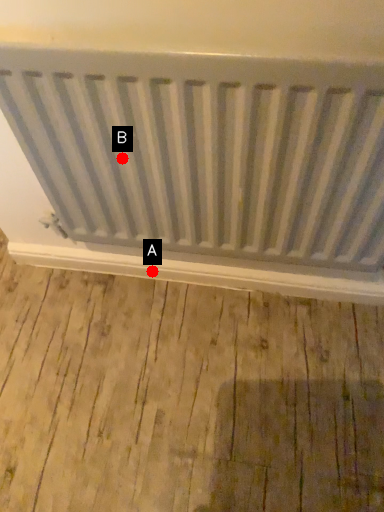
Question: Two points are circled on the image, labeled by A and B beside each circle. Among these points, which one is nearest to the camera?

Choices:
 (A) A is closer
 (B) B is closer

Answer: (B)